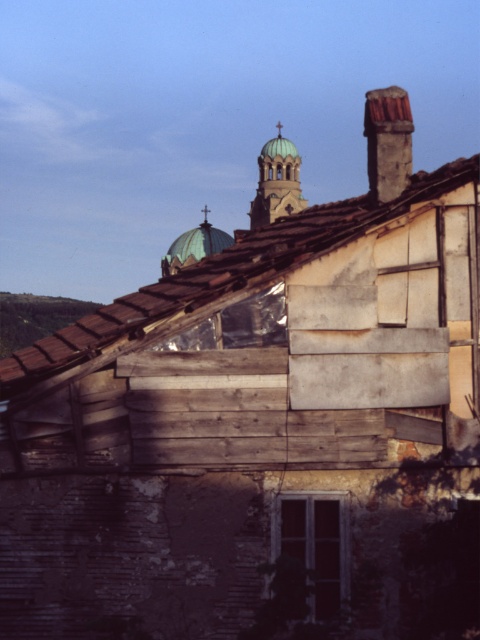
Consider the image. You are an architect analyzing the building in the image. You notice the brown shingles at upper left and the rusty metal chimney at upper right. Which of these two objects is positioned further to the left in the image?

The brown shingles at upper left are positioned to the left of the rusty metal chimney at upper right, so they are further to the left.